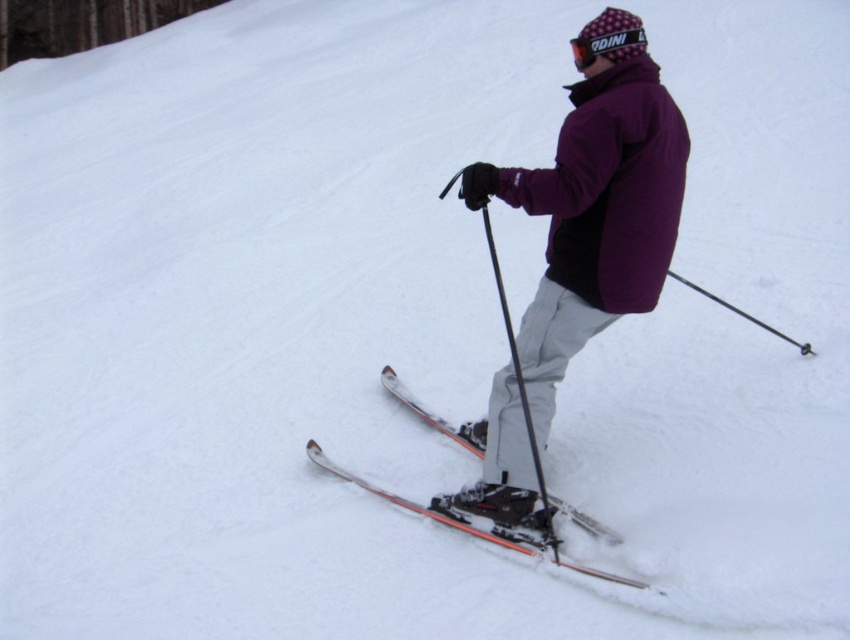
Can you confirm if purple fleece jacket at center is smaller than orange metallic skis at center?

Incorrect, purple fleece jacket at center is not smaller in size than orange metallic skis at center.

Between purple fleece jacket at center and orange metallic skis at center, which one appears on the left side from the viewer's perspective?

From the viewer's perspective, orange metallic skis at center appears more on the left side.

Describe the element at coordinates (595, 202) in the screenshot. I see `purple fleece jacket at center` at that location.

What are the coordinates of `purple fleece jacket at center` in the screenshot? It's located at (595, 202).